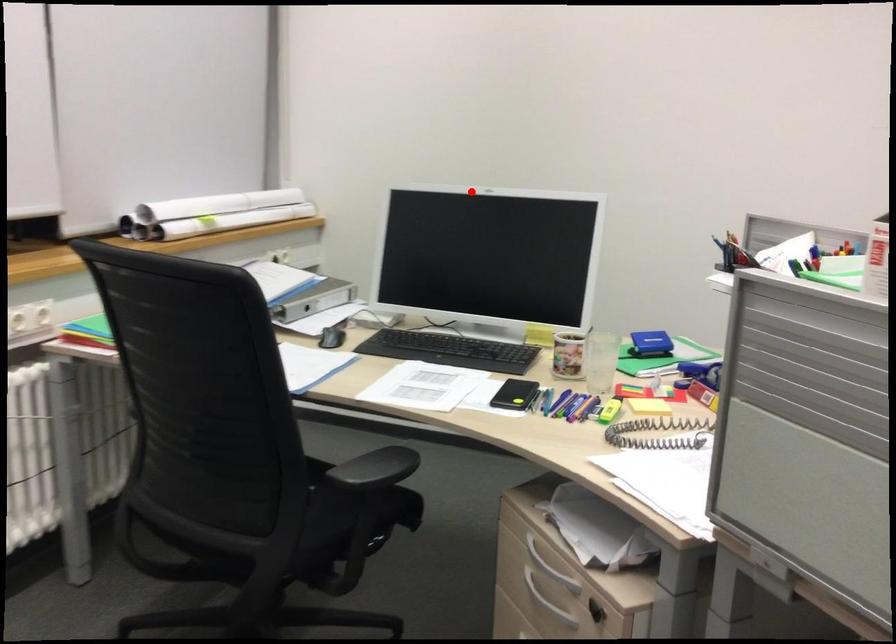
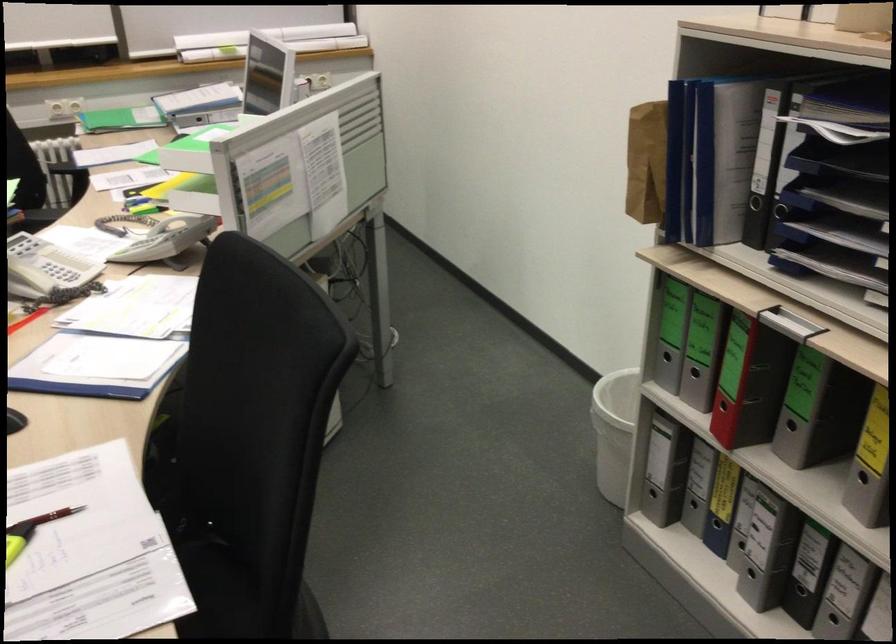
Question: I am providing you with two images of the same scene from different viewpoints. In image1, a red point is highlighted. Considering the same 3D point in image2, which of the following is correct?

Choices:
 (A) It is closer
 (B) It is farther

Answer: (B)